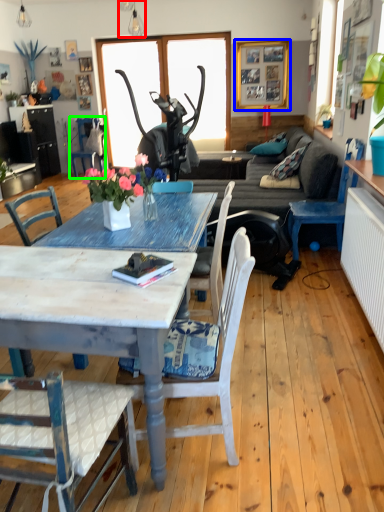
Question: Based on their relative distances, which object is farther from lamp (highlighted by a red box)? Choose from picture frame (highlighted by a blue box) and chair (highlighted by a green box).

Choices:
 (A) picture frame
 (B) chair

Answer: (A)